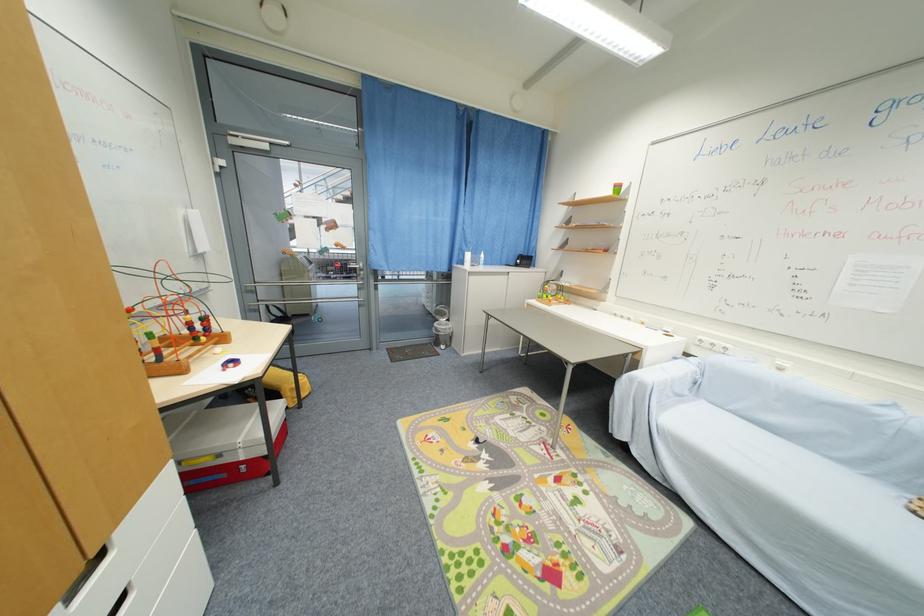
Find where to rest the sofa armrest. Please return your answer as a coordinate pair (x, y).

(669, 379)